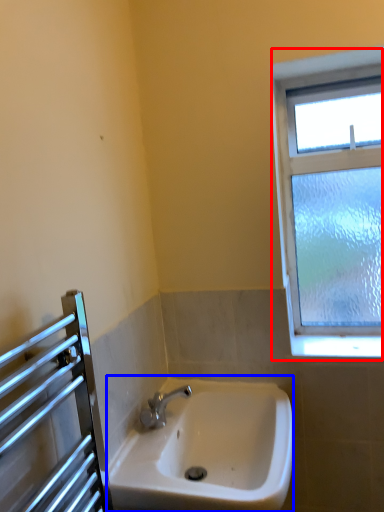
Question: Which object appears closest to the camera in this image, window (highlighted by a red box) or sink (highlighted by a blue box)?

Choices:
 (A) window
 (B) sink

Answer: (B)